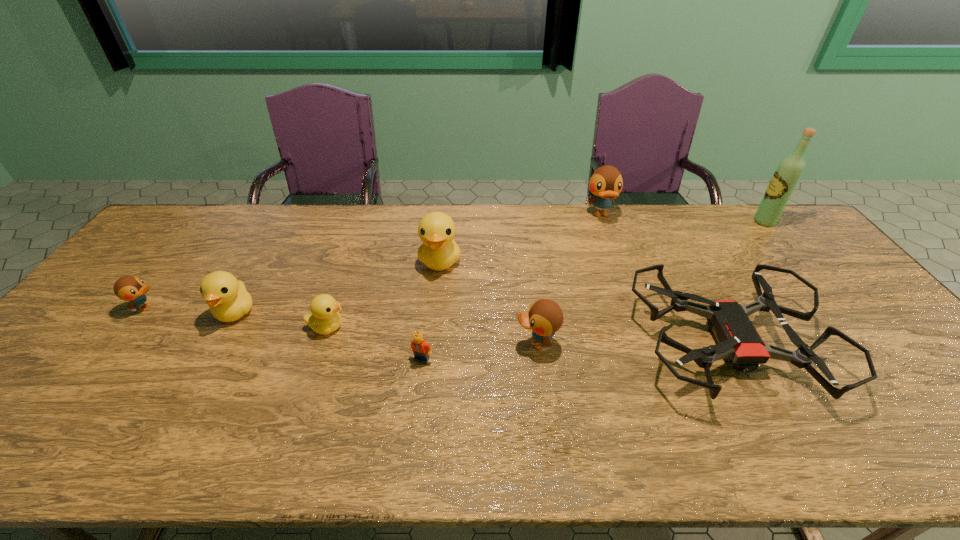
The width and height of the screenshot is (960, 540). I want to click on unoccupied position between the farthest yellow duck and the second duck from right to left, so click(x=489, y=302).

The width and height of the screenshot is (960, 540). I want to click on blank region between the tallest object and the second object from left to right, so click(x=500, y=267).

Where is `vacant point located between the leftmost object and the second object from left to right`? The height and width of the screenshot is (540, 960). vacant point located between the leftmost object and the second object from left to right is located at coordinates (191, 309).

The width and height of the screenshot is (960, 540). I want to click on vacant space that is in between the third object from left to right and the farthest yellow duck, so click(x=383, y=294).

This screenshot has width=960, height=540. In order to click on free space between the nearest blue duck and the leftmost blue duck in this screenshot , I will do (342, 326).

Locate an element on the screen. The height and width of the screenshot is (540, 960). free space between the biggest blue duck and the wine bottle is located at coordinates (683, 218).

At what (x,y) coordinates should I click in order to perform the action: click on blank region between the rightmost blue duck and the rightmost yellow duck. Please return your answer as a coordinate pair (x, y). This screenshot has width=960, height=540. Looking at the image, I should click on (520, 238).

Where is `vacant point located between the tallest object and the smallest yellow duck`? The height and width of the screenshot is (540, 960). vacant point located between the tallest object and the smallest yellow duck is located at coordinates (545, 274).

Identify which object is located as the seventh nearest to the fourth object from right to left. Please provide its 2D coordinates. Your answer should be formatted as a tuple, i.e. [(x, y)], where the tuple contains the x and y coordinates of a point satisfying the conditions above.

[(787, 175)]

Identify which object is located as the second nearest to the seventh nearest object. Please provide its 2D coordinates. Your answer should be formatted as a tuple, i.e. [(x, y)], where the tuple contains the x and y coordinates of a point satisfying the conditions above.

[(545, 317)]